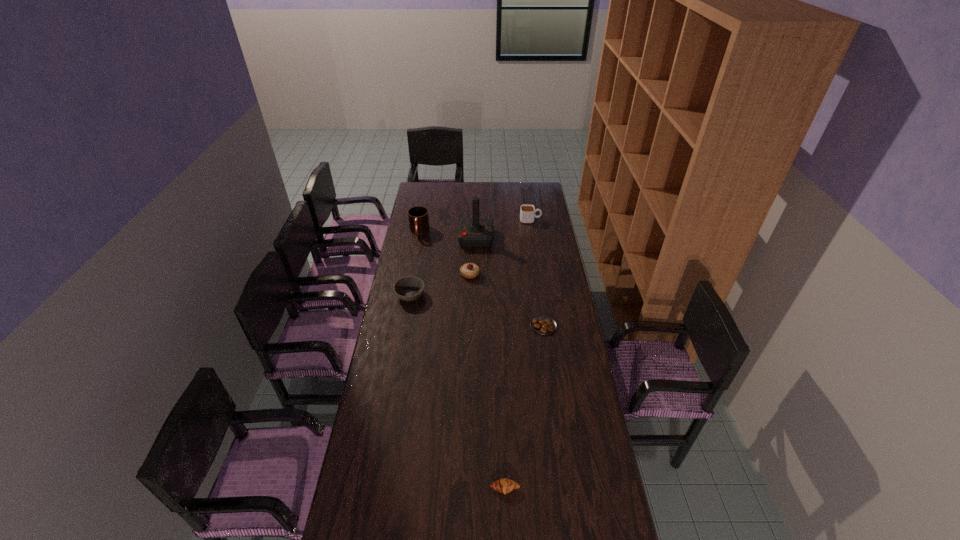
At what (x,y) coordinates should I click in order to perform the action: click on the second nearest pastry. Please return your answer as a coordinate pair (x, y). Looking at the image, I should click on (541, 324).

I want to click on free region located 0.070m on the rectangular base of the joystick, so click(x=505, y=238).

Locate an element on the screen. This screenshot has height=540, width=960. vacant space situated 0.170m on the side of the second tallest object with the handle is located at coordinates (414, 260).

The width and height of the screenshot is (960, 540). I want to click on free space located on the side with the handle of the cup, so click(x=550, y=220).

The image size is (960, 540). In order to click on vacant space located 0.310m on the front of the farthest pastry in this screenshot , I will do [468, 327].

Identify the location of vacant space located 0.380m on the right of the bowl. The width and height of the screenshot is (960, 540). (504, 295).

At what (x,y) coordinates should I click in order to perform the action: click on blank area located 0.060m on the left of the shortest object. Please return your answer as a coordinate pair (x, y). The height and width of the screenshot is (540, 960). Looking at the image, I should click on (516, 326).

Locate an element on the screen. This screenshot has width=960, height=540. mug present at the left edge is located at coordinates (418, 218).

This screenshot has height=540, width=960. Identify the location of bowl at the left edge. (410, 288).

Locate an element on the screen. The image size is (960, 540). cup located in the right edge section of the desktop is located at coordinates (x=527, y=211).